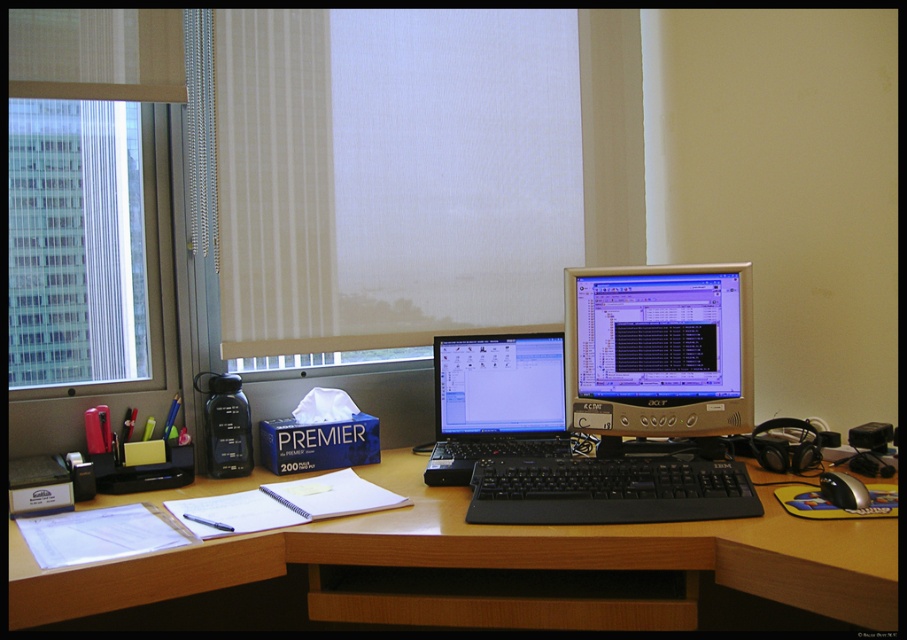
Can you confirm if wooden at center is positioned below black plastic laptop at center?

Yes, wooden at center is below black plastic laptop at center.

Measure the distance between point (8,579) and camera.

Point (8,579) and camera are 1.25 meters apart.

Locate an element on the screen. The height and width of the screenshot is (640, 907). wooden at center is located at coordinates (496, 564).

Does wooden at center have a smaller size compared to transparent glass window at left?

No.

Measure the distance from wooden at center to transparent glass window at left.

wooden at center and transparent glass window at left are 28.12 inches apart from each other.

Identify the location of wooden at center. (496, 564).

Is point (538, 250) in front of point (700, 289)?

No.

Between point (442, 156) and point (597, 362), which one is positioned in front?

Point (597, 362)

Does point (230, 365) come behind point (730, 333)?

Yes.

At what (x,y) coordinates should I click in order to perform the action: click on beige fabric curtain at upper center. Please return your answer as a coordinate pair (x, y). Image resolution: width=907 pixels, height=640 pixels. Looking at the image, I should click on (392, 177).